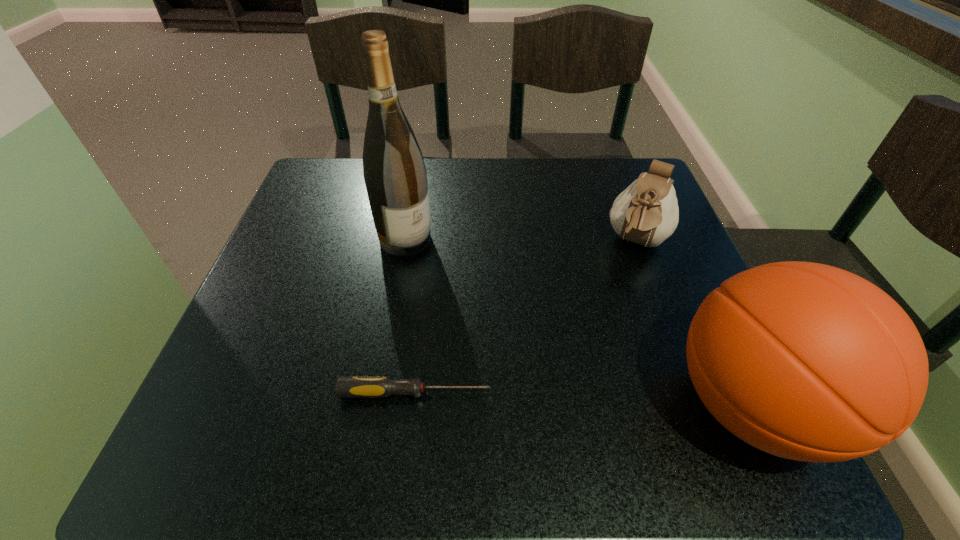
Locate an element on the screen. The image size is (960, 540). vacant space located 0.070m on the label of the tallest object is located at coordinates (444, 269).

Image resolution: width=960 pixels, height=540 pixels. Find the location of `vacant space located on the label of the tallest object`. vacant space located on the label of the tallest object is located at coordinates (514, 326).

Locate an element on the screen. screwdriver at the near edge is located at coordinates (347, 386).

At what (x,y) coordinates should I click in order to perform the action: click on basketball located at the near edge. Please return your answer as a coordinate pair (x, y). The width and height of the screenshot is (960, 540). Looking at the image, I should click on (805, 361).

Identify the location of basketball located in the right edge section of the desktop. This screenshot has width=960, height=540. (805, 361).

You are a GUI agent. You are given a task and a screenshot of the screen. Output one action in this format:
    pyautogui.click(x=<x>, y=<y>)
    Task: Click on the pouch that is positioned at the right edge
    The width and height of the screenshot is (960, 540).
    Given the screenshot: What is the action you would take?
    646,212

Where is `object at the near right corner`? object at the near right corner is located at coordinates (805, 361).

Where is `vacant region at the far edge of the desktop`? This screenshot has width=960, height=540. vacant region at the far edge of the desktop is located at coordinates pyautogui.click(x=368, y=197).

Find the location of a particular element. The height and width of the screenshot is (540, 960). vacant region at the near edge is located at coordinates (449, 406).

In the image, there is a desktop. Where is `free space at the right edge`? This screenshot has height=540, width=960. free space at the right edge is located at coordinates (636, 276).